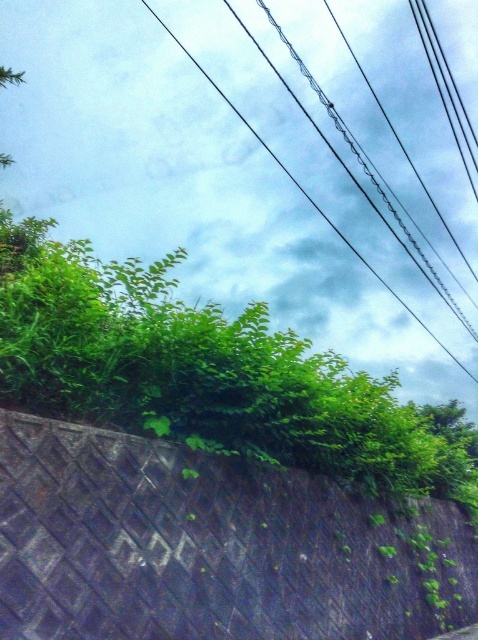
Who is shorter, dark gray textured ramp at lower left or black wire at upper center?

With less height is dark gray textured ramp at lower left.

In order to click on dark gray textured ramp at lower left in this screenshot , I will do `click(210, 547)`.